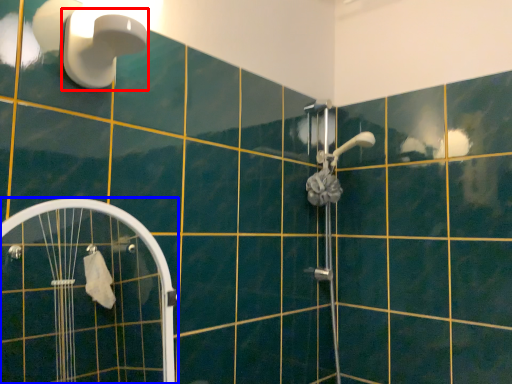
Question: Among these objects, which one is nearest to the camera, shower (highlighted by a red box) or screen door (highlighted by a blue box)?

Choices:
 (A) shower
 (B) screen door

Answer: (B)